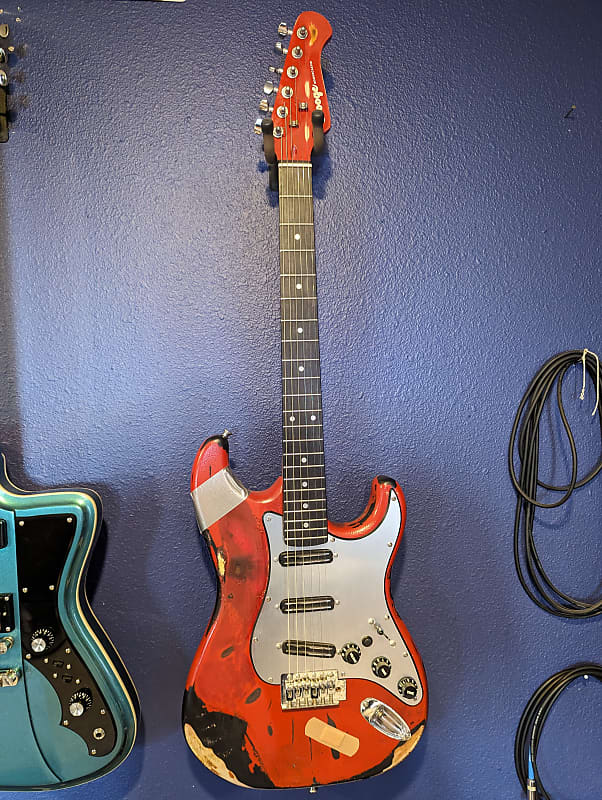
This screenshot has height=800, width=602. Identify the location of black cords. (525, 725).